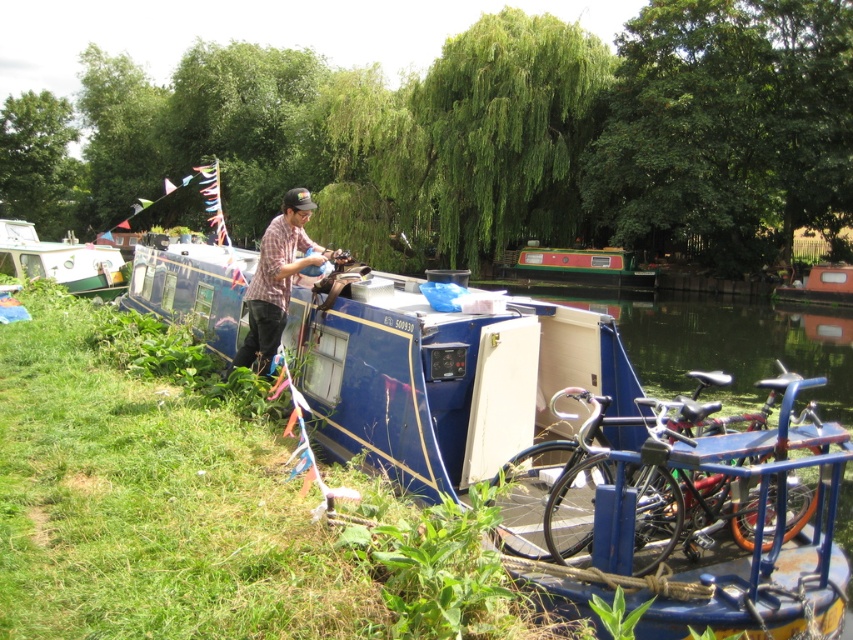
Find the location of a particular element. shiny metallic bicycles at lower right is located at coordinates [688, 512].

Which is below, shiny metallic bicycles at lower right or orange matte boat at center?

shiny metallic bicycles at lower right is lower down.

Where is `shiny metallic bicycles at lower right`? The image size is (853, 640). shiny metallic bicycles at lower right is located at coordinates (688, 512).

Which of these two, shiny metallic bicycles at lower right or white wooden houseboat at left, stands taller?

white wooden houseboat at left is taller.

Is shiny metallic bicycles at lower right shorter than white wooden houseboat at left?

Correct, shiny metallic bicycles at lower right is not as tall as white wooden houseboat at left.

Measure the distance between point (592, 464) and camera.

Point (592, 464) and camera are 11.49 feet apart from each other.

Locate an element on the screen. This screenshot has height=640, width=853. shiny metallic bicycles at lower right is located at coordinates (688, 512).

Between point (18, 253) and point (596, 284), which one is positioned behind?

Positioned behind is point (596, 284).

Is point (0, 224) closer to camera compared to point (619, 260)?

Yes, point (0, 224) is in front of point (619, 260).

Locate an element on the screen. white wooden houseboat at left is located at coordinates (59, 260).